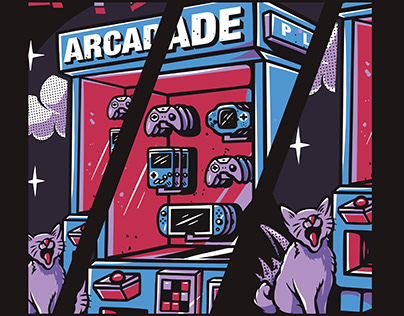
The image size is (404, 316). I want to click on game controllers, so click(236, 169), click(177, 121), click(120, 105).